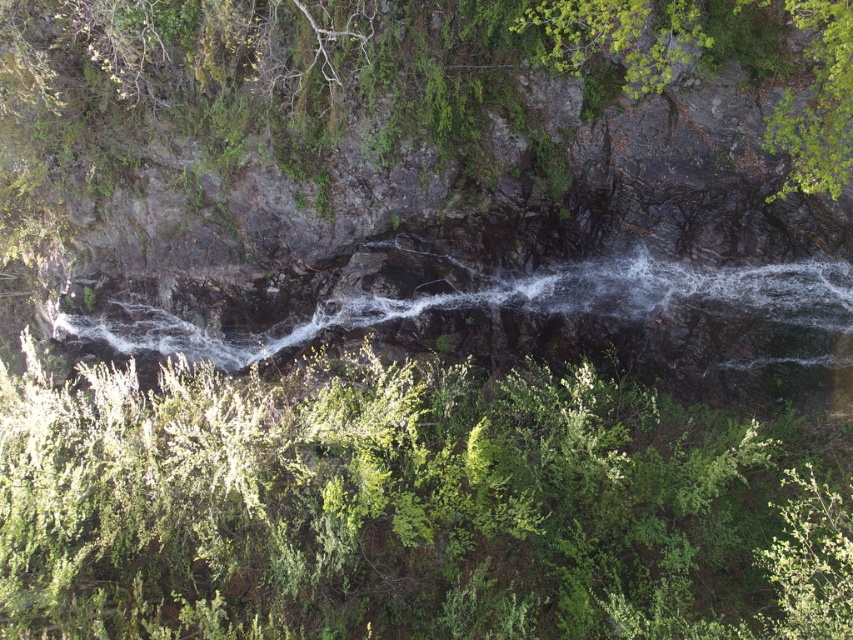
Is green leafy shrub at upper center further to the viewer compared to white frothy water at center?

No.

What do you see at coordinates (407, 506) in the screenshot? I see `green leafy shrub at upper center` at bounding box center [407, 506].

Is point (573, 621) in front of point (502, 291)?

Yes, point (573, 621) is in front of point (502, 291).

Locate an element on the screen. This screenshot has width=853, height=640. green leafy shrub at upper center is located at coordinates (407, 506).